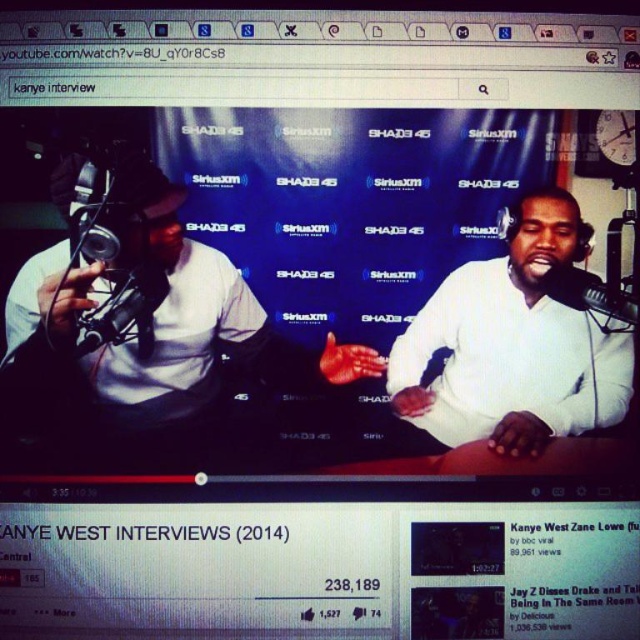
Question: Does matte white shirt at left have a lesser width compared to black matte microphone at right?

Choices:
 (A) no
 (B) yes

Answer: (A)

Question: Is matte white shirt at left to the right of white matte shirt at right from the viewer's perspective?

Choices:
 (A) no
 (B) yes

Answer: (A)

Question: Which point is closer to the camera?

Choices:
 (A) matte white shirt at left
 (B) white matte shirt at right
 (C) black matte microphone at right

Answer: (A)

Question: Which is farther from the black matte microphone at right?

Choices:
 (A) white matte shirt at right
 (B) matte white shirt at left

Answer: (B)

Question: Is white matte shirt at right wider than black matte microphone at right?

Choices:
 (A) no
 (B) yes

Answer: (B)

Question: Among these objects, which one is nearest to the camera?

Choices:
 (A) matte white shirt at left
 (B) white matte shirt at right
 (C) black matte microphone at right

Answer: (A)